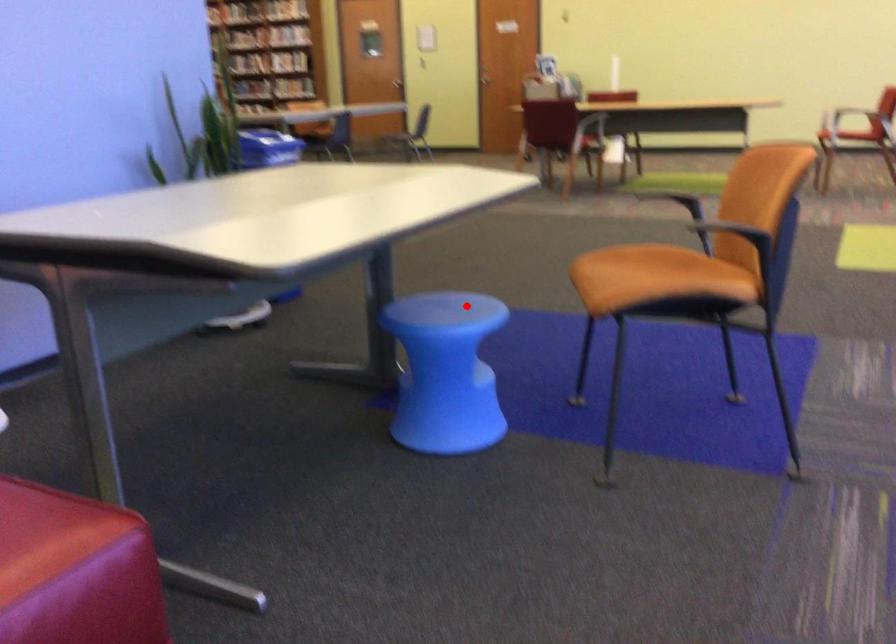
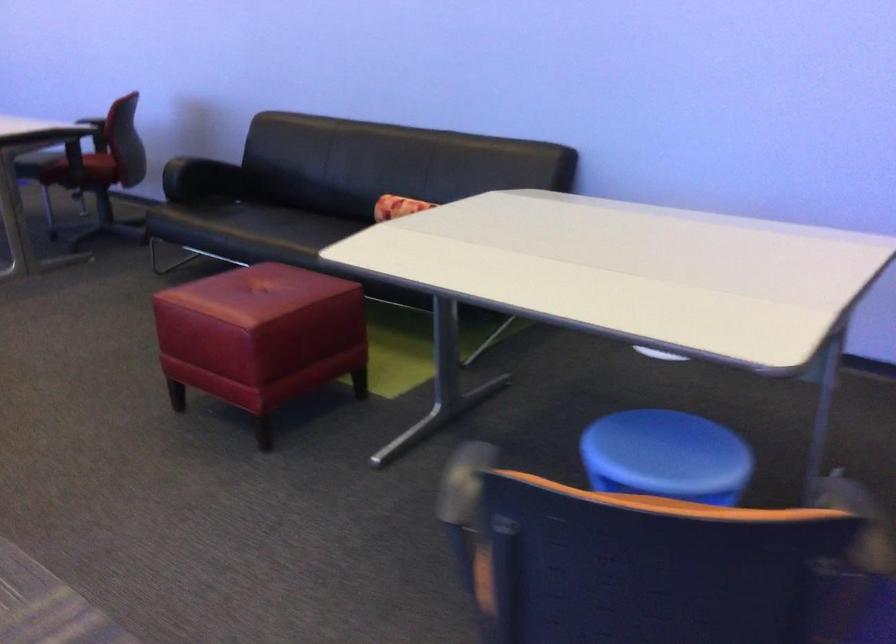
Question: I am providing you with two images of the same scene from different viewpoints. Image1 has a red point marked. In image2, the corresponding 3D location appears at what relative position? Reply with the corresponding letter.

Choices:
 (A) Closer
 (B) Farther

Answer: (A)